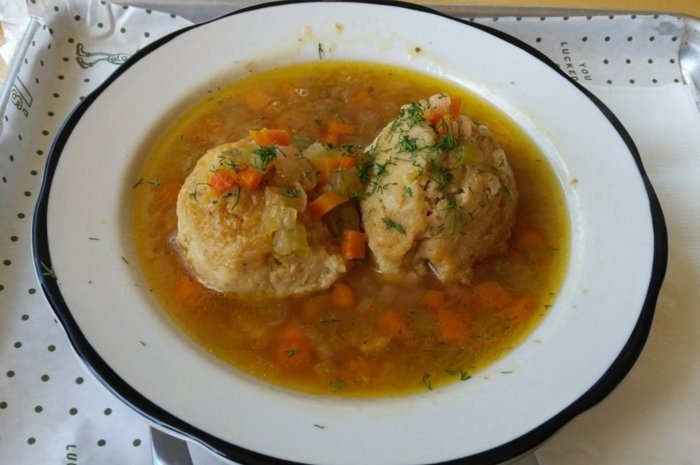
In order to click on white bowl in this screenshot , I will do `click(600, 222)`.